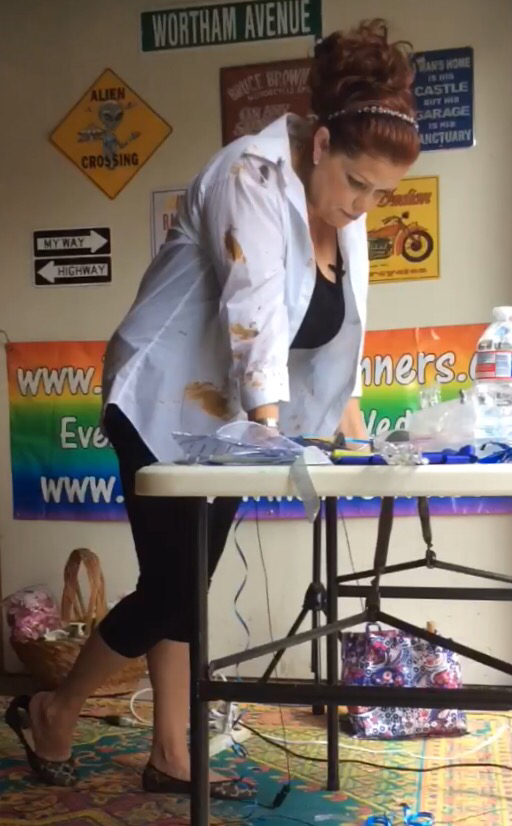
Where is `power strip`? The image size is (512, 826). power strip is located at coordinates (222, 738).